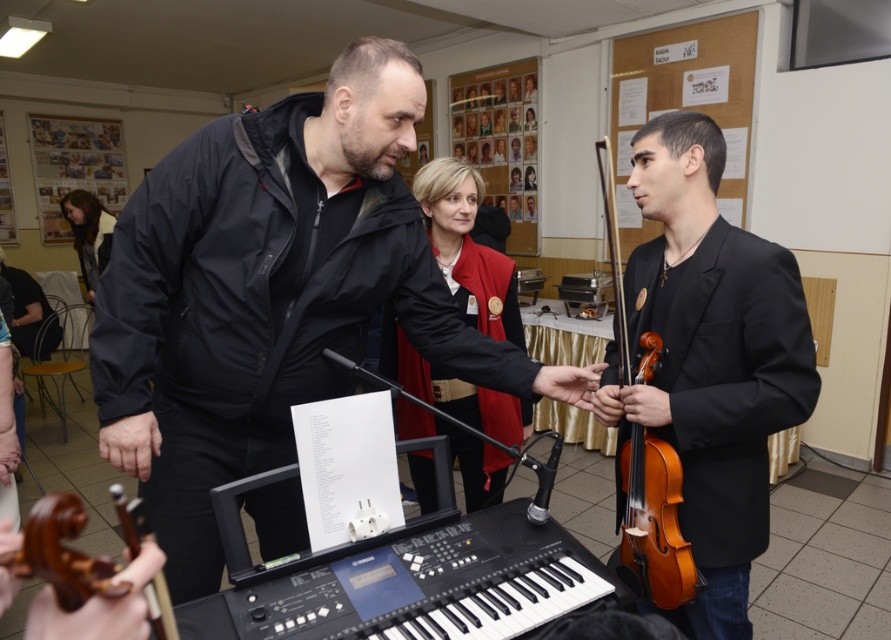
Question: Estimate the real-world distances between objects in this image. Which object is farther from the wooden violin at right?

Choices:
 (A) black matte jacket at center
 (B) wooden violin at center
 (C) blonde hair at upper left

Answer: (C)

Question: Is shiny brown violin at right smaller than wooden violin at right?

Choices:
 (A) yes
 (B) no

Answer: (B)

Question: Is black matte jacket at center bigger than blonde hair at upper left?

Choices:
 (A) no
 (B) yes

Answer: (A)

Question: Can you confirm if black plastic keyboard at center is positioned below wooden violin at center?

Choices:
 (A) no
 (B) yes

Answer: (A)

Question: Which object is farther from the camera taking this photo?

Choices:
 (A) shiny brown violin at right
 (B) blonde hair at upper left
 (C) black plastic keyboard at center

Answer: (B)

Question: Which object is positioned closest to the black plastic keyboard at center?

Choices:
 (A) black matte jacket at center
 (B) shiny brown violin at right
 (C) wooden violin at right

Answer: (A)